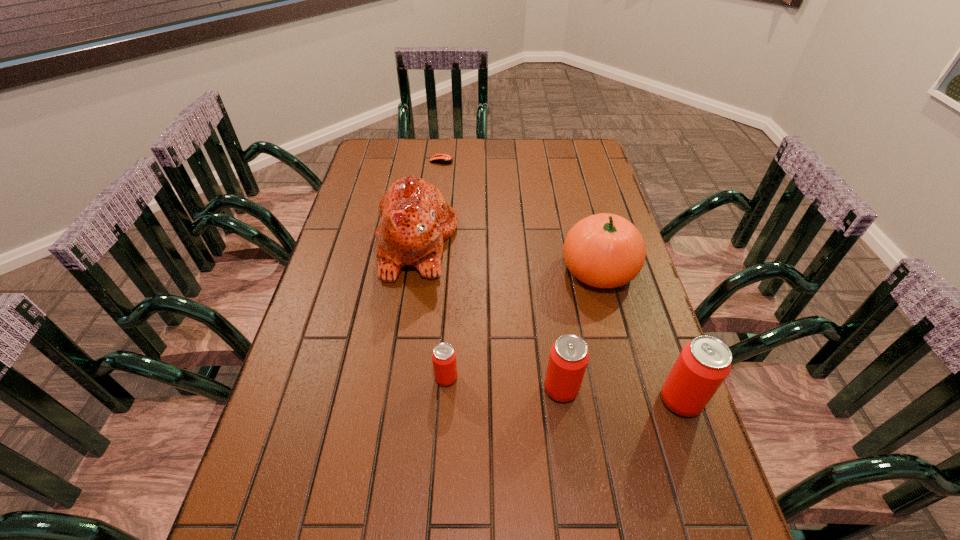
Locate an element on the screen. This screenshot has height=540, width=960. vacant space located 0.400m on the back of the second beer can from right to left is located at coordinates tap(542, 259).

Find the location of `blank space located on the left of the rightmost beer can`. blank space located on the left of the rightmost beer can is located at coordinates (603, 400).

You are a GUI agent. You are given a task and a screenshot of the screen. Output one action in this format:
    pyautogui.click(x=<x>, y=<y>)
    Task: Click on the vacant space located on the front of the shortest object
    The height and width of the screenshot is (540, 960).
    Given the screenshot: What is the action you would take?
    [437, 202]

This screenshot has height=540, width=960. Find the location of `vacant space located on the back of the pumpkin`. vacant space located on the back of the pumpkin is located at coordinates click(577, 188).

The image size is (960, 540). I want to click on vacant area located 0.350m on the face of the tallest object, so click(x=568, y=242).

What are the coordinates of `object that is at the far edge` in the screenshot? It's located at (444, 159).

This screenshot has height=540, width=960. Identify the location of object located at the left edge. (415, 219).

This screenshot has width=960, height=540. Find the location of `beer can located in the right edge section of the desktop`. beer can located in the right edge section of the desktop is located at coordinates (704, 363).

What are the coordinates of `pumpkin that is at the right edge` in the screenshot? It's located at (604, 250).

Locate an element on the screen. The width and height of the screenshot is (960, 540). blank space at the far edge of the desktop is located at coordinates (513, 170).